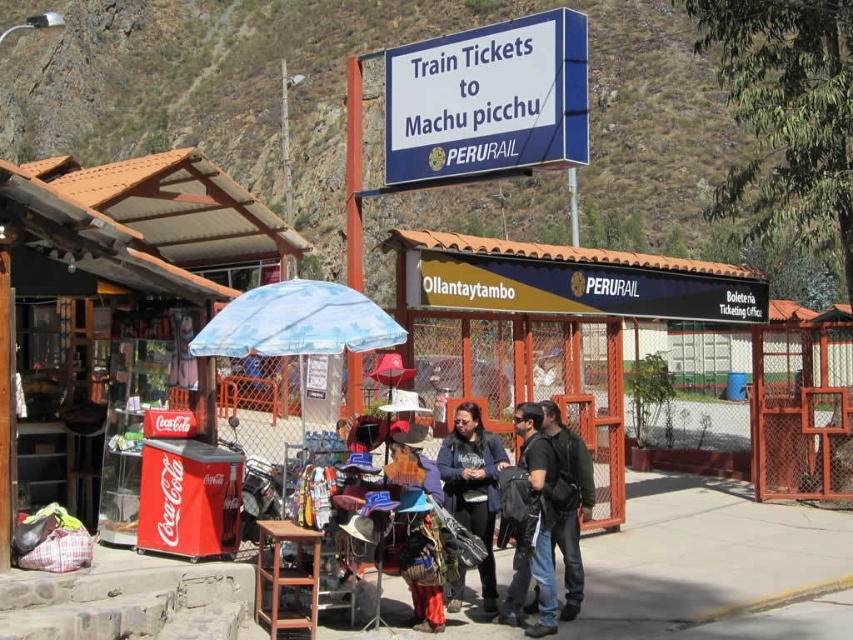
Question: Based on their relative distances, which object is nearer to the yellow corrugated metal at center?

Choices:
 (A) blue printed fabric umbrella at center
 (B) concrete pavement at center
 (C) wooden stool at center

Answer: (B)

Question: Is yellow corrugated metal at center behind wooden stool at center?

Choices:
 (A) yes
 (B) no

Answer: (A)

Question: Does red plastic coca-cola cooler at left have a smaller size compared to concrete pavement at center?

Choices:
 (A) no
 (B) yes

Answer: (A)

Question: Among these points, which one is farthest from the camera?

Choices:
 (A) (552, 481)
 (B) (503, 557)
 (C) (766, 321)

Answer: (C)

Question: Which of these objects is positioned farthest from the wooden stool at center?

Choices:
 (A) dark blue jacket at center
 (B) blue printed fabric umbrella at center
 (C) yellow corrugated metal at center

Answer: (C)

Question: Considering the relative positions of blue printed fabric umbrella at center and wooden stool at center in the image provided, where is blue printed fabric umbrella at center located with respect to wooden stool at center?

Choices:
 (A) left
 (B) right

Answer: (A)